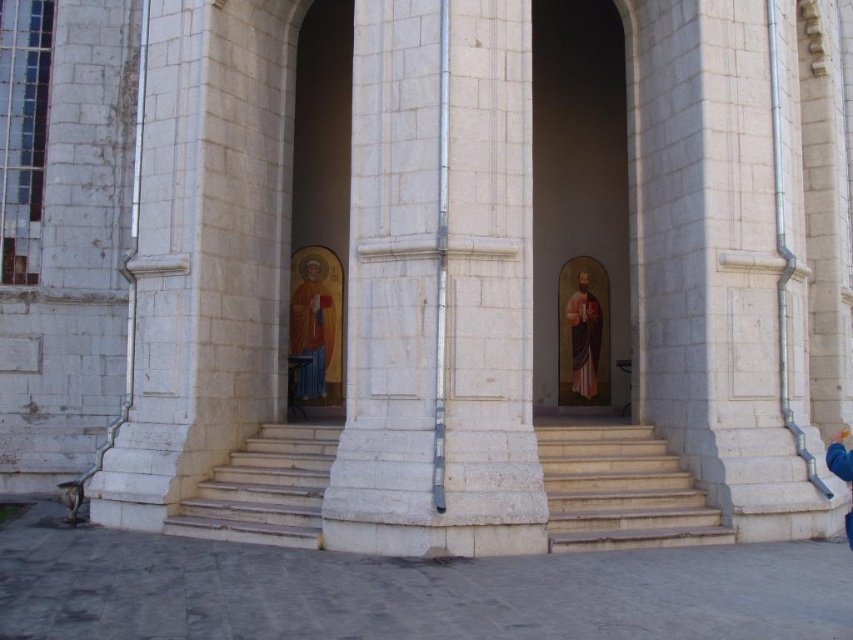
Looking at this image, you are standing in front of the building and want to walk from the point at coordinates point (604, 172) to point (318, 208). Which direction should you move?

Since point (604, 172) is behind point (318, 208), you should move forward towards the building to reach point (318, 208) from point (604, 172).

You are standing inside the building and want to find the entrance to the main chapel. You see a matte wooden icon at center and light brown stone stairs at center. Which object should you approach to locate the entrance?

The entrance to the main chapel is likely near the matte wooden icon at center, as it is positioned on the left side of the light brown stone stairs at center, indicating its proximity to the entrance area.